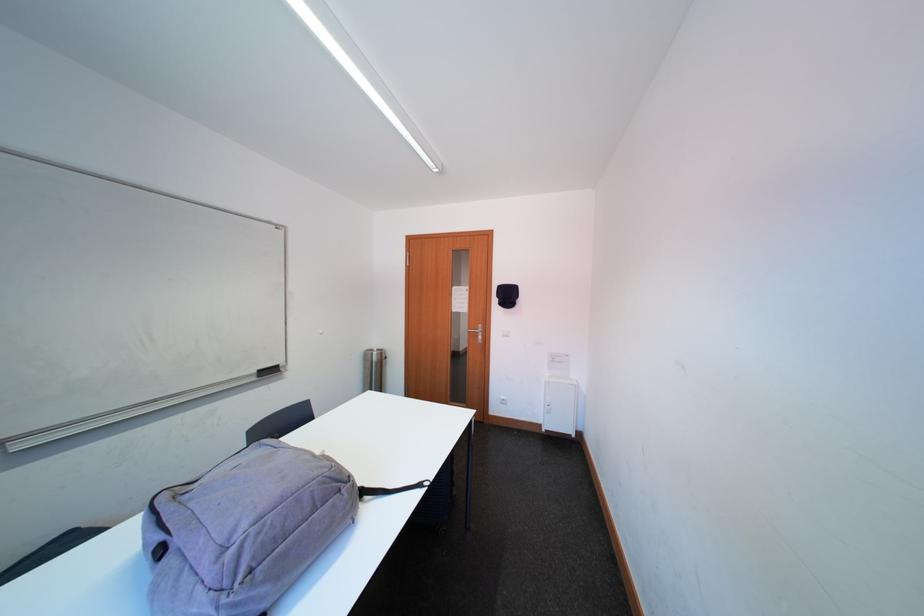
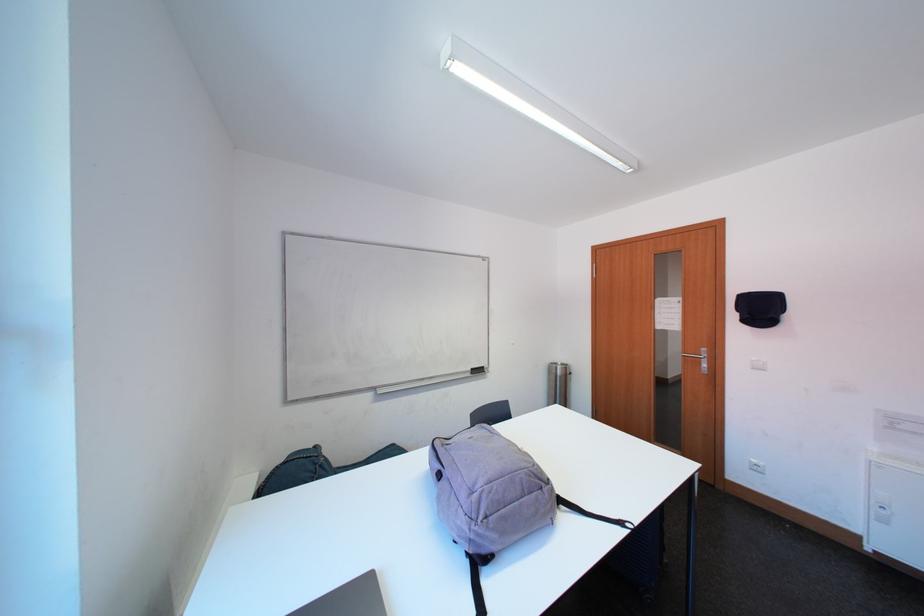
In the second image, find the point that corresponds to (x=481, y=339) in the first image.

(699, 365)